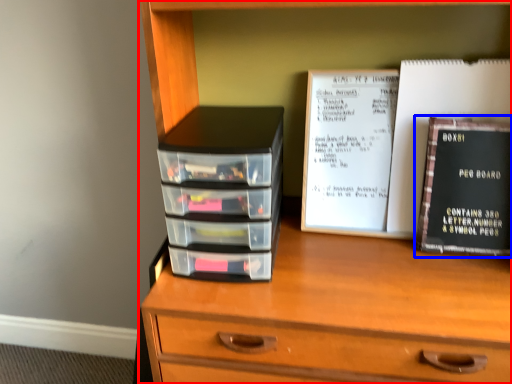
Question: Which of the following is the closest to the observer, chest of drawers (highlighted by a red box) or book (highlighted by a blue box)?

Choices:
 (A) chest of drawers
 (B) book

Answer: (A)